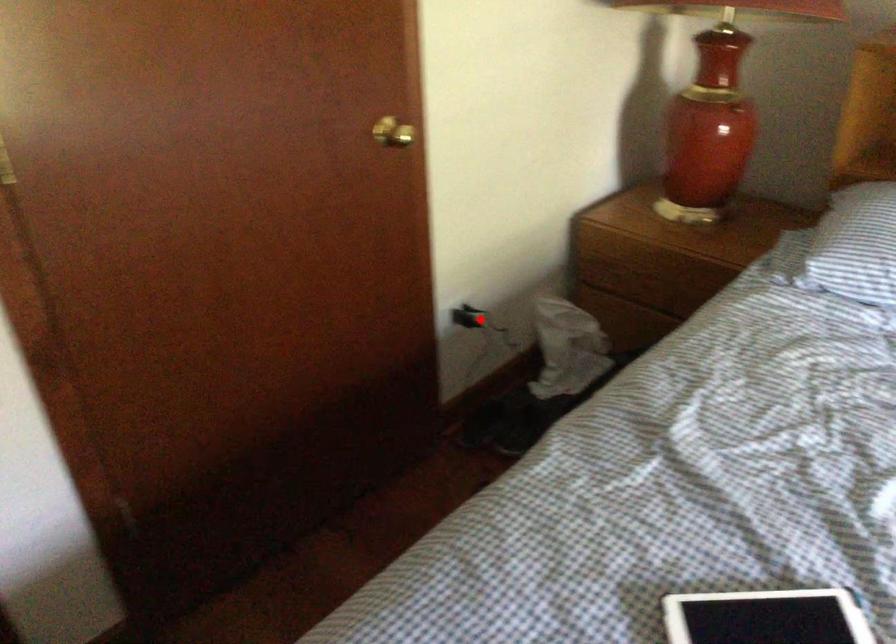
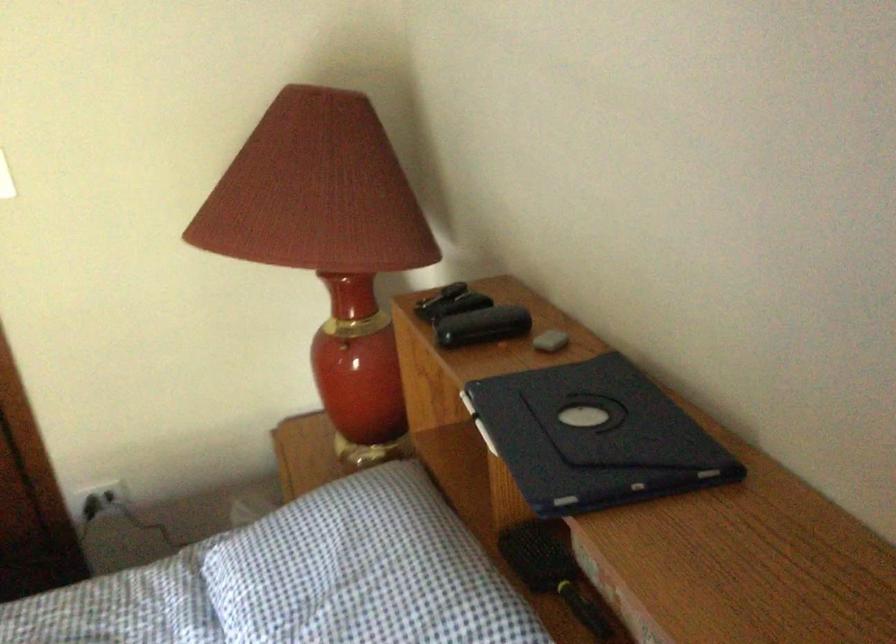
Question: I am providing you with two images of the same scene from different viewpoints. A red point is marked on the first image. Is the red point's position out of view in image 2?

Choices:
 (A) Yes
 (B) No

Answer: (B)